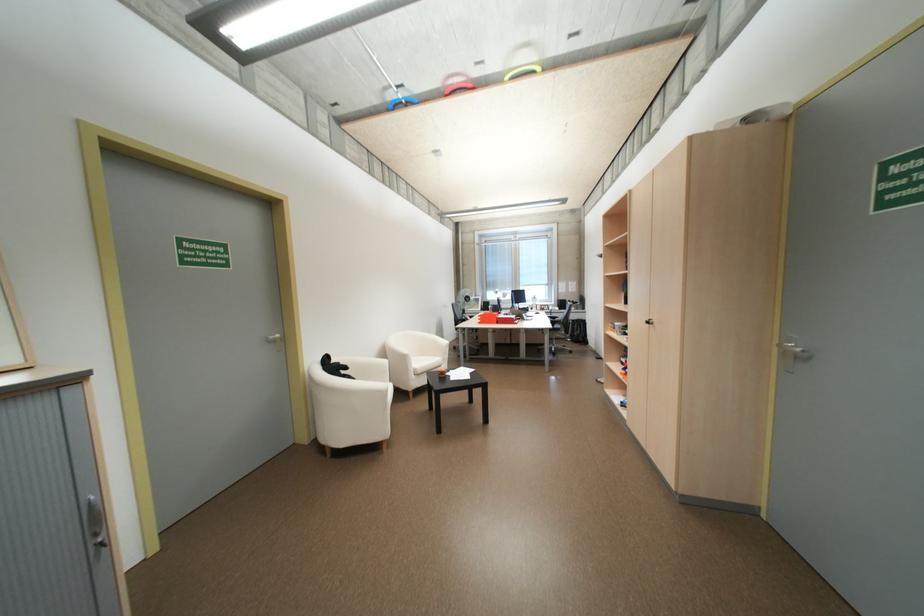
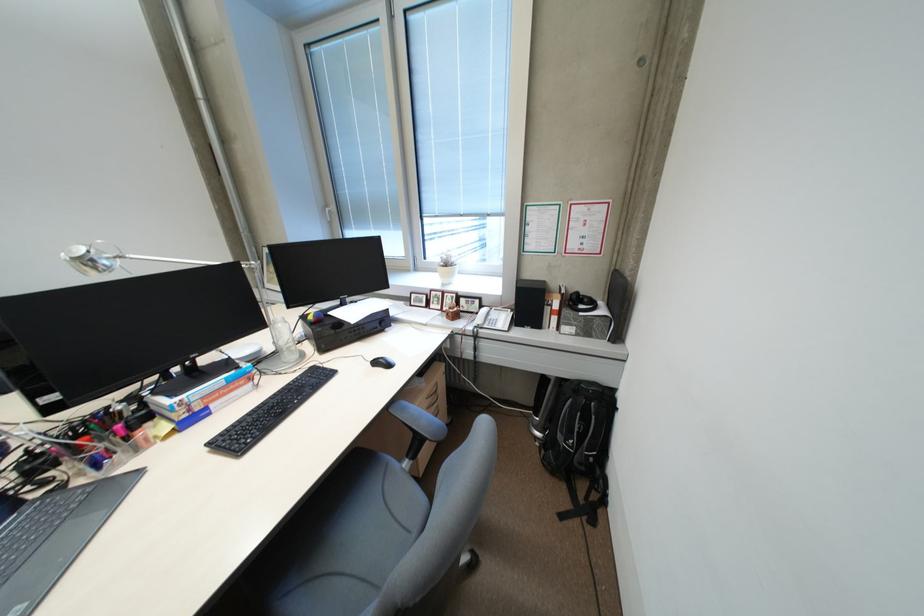
In the second image, find the point that corresponds to point (572, 304) in the first image.

(538, 302)